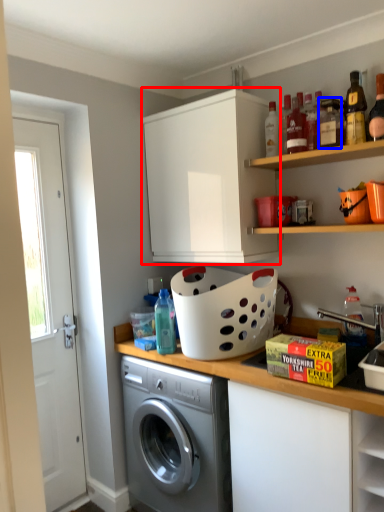
Question: Which point is further to the camera, cabinetry (highlighted by a red box) or bottle (highlighted by a blue box)?

Choices:
 (A) cabinetry
 (B) bottle

Answer: (A)